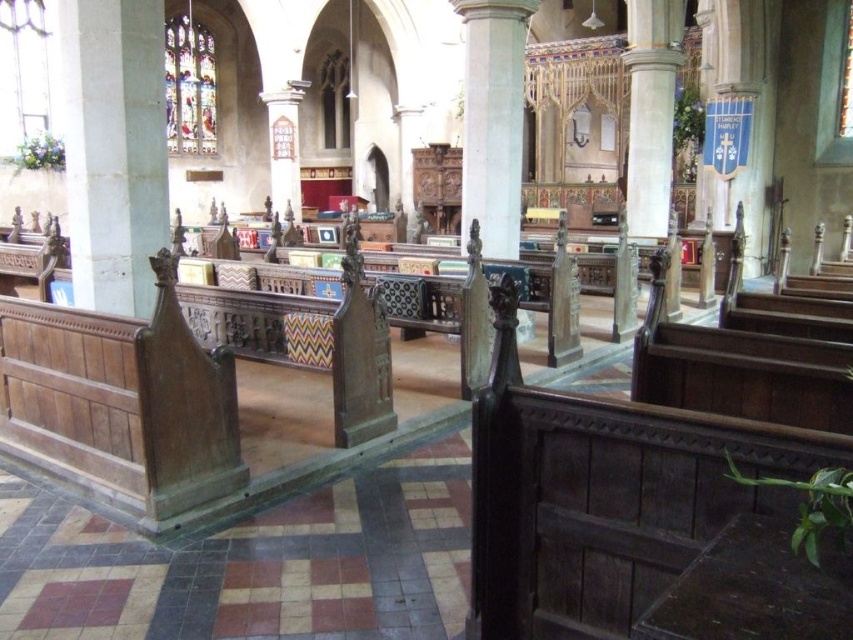
Question: Which of the following is the farthest from the observer?

Choices:
 (A) white stone pillar at left
 (B) white stone column at center

Answer: (B)

Question: Among these objects, which one is nearest to the camera?

Choices:
 (A) white stone column at center
 (B) white stone pillar at left

Answer: (B)

Question: Is white stone pillar at left thinner than white stone column at center?

Choices:
 (A) yes
 (B) no

Answer: (B)

Question: Among these points, which one is farthest from the camera?

Choices:
 (A) (131, 83)
 (B) (489, 182)

Answer: (B)

Question: Does white stone pillar at left appear under white stone column at center?

Choices:
 (A) yes
 (B) no

Answer: (A)

Question: Is white stone pillar at left positioned before white stone column at center?

Choices:
 (A) yes
 (B) no

Answer: (A)